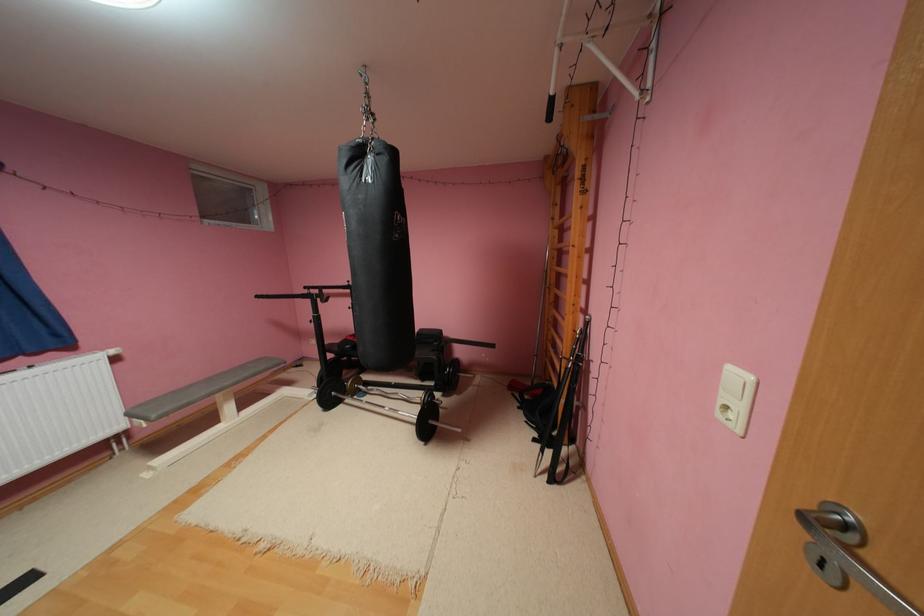
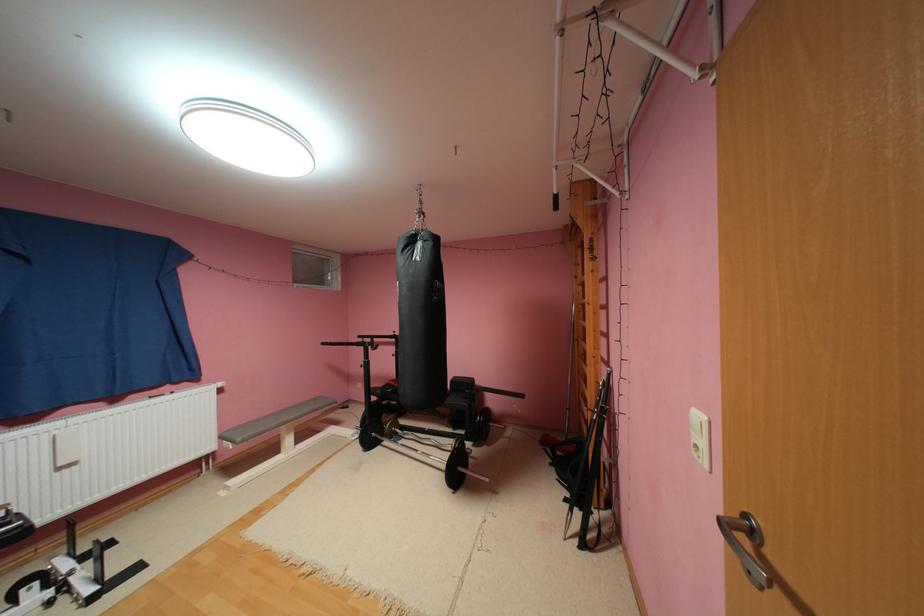
The point at (323, 395) is marked in the first image. Where is the corresponding point in the second image?

(366, 436)